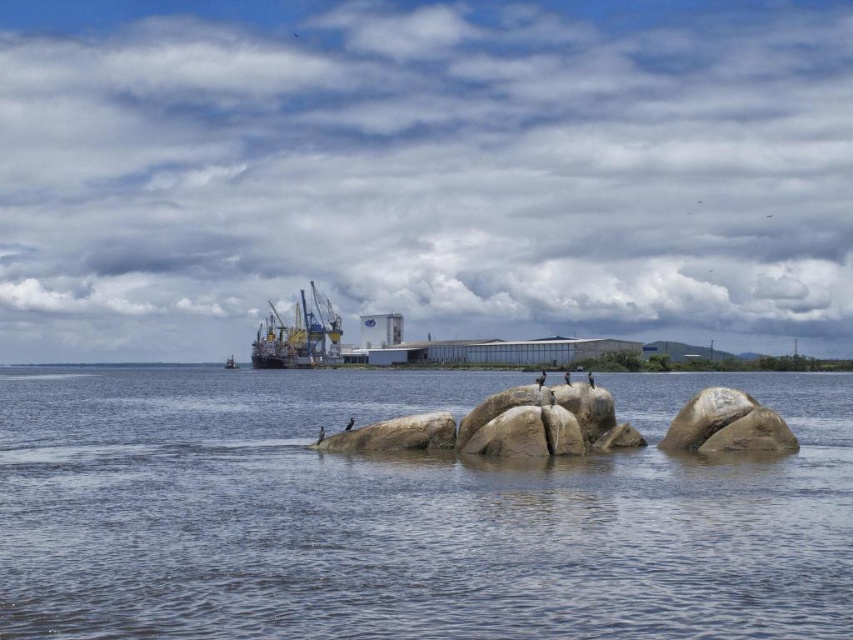
You are standing on the rocks in the foreground of the coastal scene. You see a metallic gray ship at center and a metallic gray boat at center. Which one is positioned to the right of the other?

The metallic gray ship at center is to the right of the metallic gray boat at center according to the description.

You are standing on the rocks in the foreground and want to walk to the metallic gray ship at center. Which direction should you go relative to the clear water at center?

You should go to the left of the clear water at center because the clear water at center is to the right of the metallic gray ship at center, so moving left from the clear water would lead towards the ship.